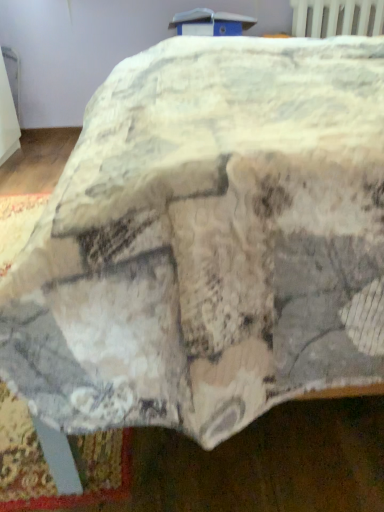
Question: From the image's perspective, is white plastic radiator at upper right positioned above or below white plastic table at upper center?

Choices:
 (A) below
 (B) above

Answer: (B)

Question: Considering their positions, is white plastic radiator at upper right located in front of or behind white plastic table at upper center?

Choices:
 (A) behind
 (B) front

Answer: (A)

Question: From a real-world perspective, is white plastic radiator at upper right above or below white plastic table at upper center?

Choices:
 (A) below
 (B) above

Answer: (A)

Question: From a real-world perspective, is white plastic table at upper center positioned above or below white plastic radiator at upper right?

Choices:
 (A) below
 (B) above

Answer: (B)

Question: From the image's perspective, is white plastic table at upper center positioned above or below white plastic radiator at upper right?

Choices:
 (A) above
 (B) below

Answer: (B)

Question: Would you say white plastic table at upper center is to the left or to the right of white plastic radiator at upper right in the picture?

Choices:
 (A) right
 (B) left

Answer: (B)

Question: Is white plastic table at upper center bigger or smaller than white plastic radiator at upper right?

Choices:
 (A) small
 (B) big

Answer: (B)